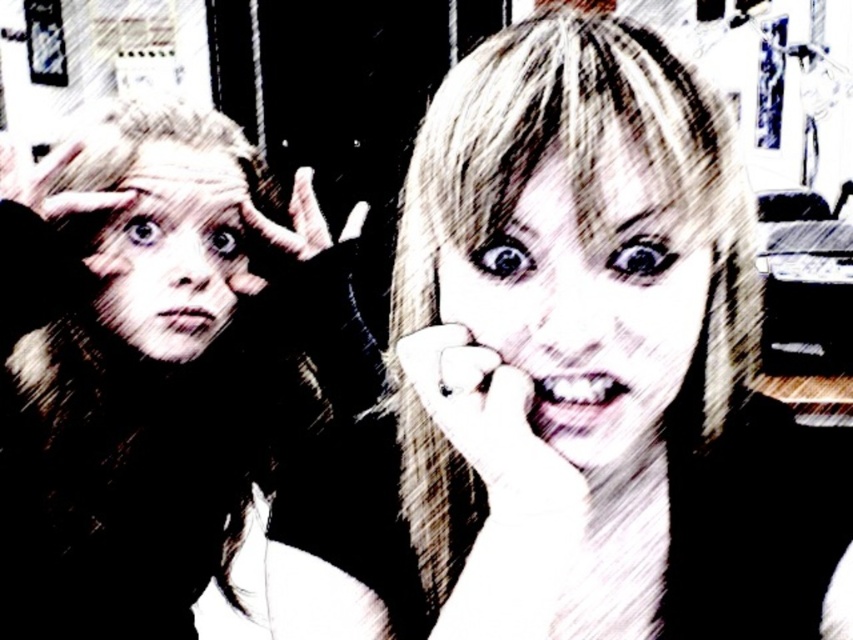
Question: Does blonde hair at center have a smaller size compared to matte black hand at upper left?

Choices:
 (A) yes
 (B) no

Answer: (B)

Question: Estimate the real-world distances between objects in this image. Which object is closer to the blonde hair at center?

Choices:
 (A) smooth skin face at center
 (B) matte black fur coat at left

Answer: (A)

Question: Estimate the real-world distances between objects in this image. Which object is closer to the black leather hand at center?

Choices:
 (A) blonde hair at center
 (B) smooth skin face at center
 (C) blonde hair at left
 (D) white matte hand at center

Answer: (C)

Question: Is matte black fur coat at left wider than matte black hand at upper left?

Choices:
 (A) no
 (B) yes

Answer: (B)

Question: Is white matte hand at center thinner than matte black hand at upper left?

Choices:
 (A) no
 (B) yes

Answer: (B)

Question: Which of the following is the farthest from the observer?

Choices:
 (A) (128, 609)
 (B) (302, 209)
 (C) (567, 176)
 (D) (3, 164)

Answer: (A)